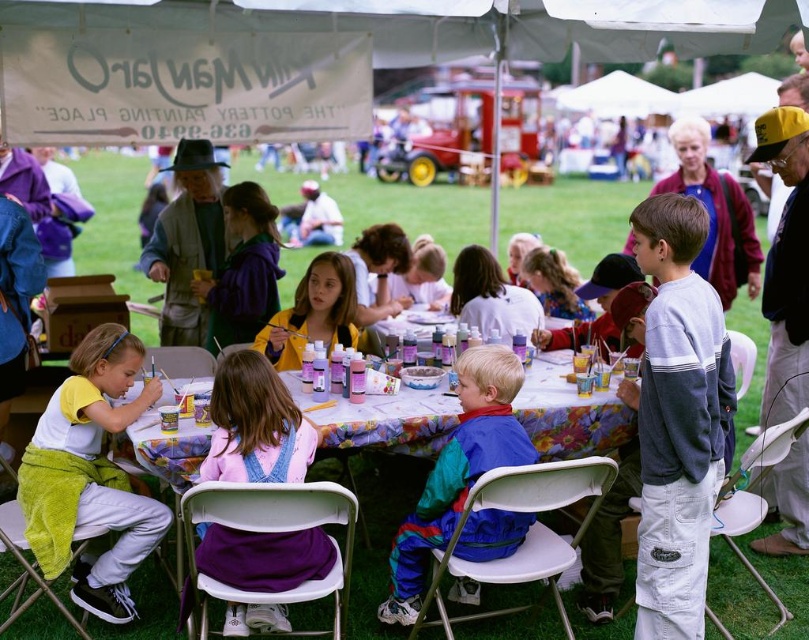
Question: Is white cotton shirt at center below rainbow nylon jacket at center?

Choices:
 (A) no
 (B) yes

Answer: (A)

Question: From the image, what is the correct spatial relationship of gray cotton sweatshirt at right in relation to floral tablecloth at center?

Choices:
 (A) below
 (B) above

Answer: (B)

Question: Considering the real-world distances, which object is closest to the rainbow nylon jacket at center?

Choices:
 (A) gray cotton sweatshirt at right
 (B) white cotton shirt at center
 (C) floral tablecloth at center

Answer: (C)

Question: Which object is closer to the camera taking this photo?

Choices:
 (A) white cotton shirt at center
 (B) floral tablecloth at center
 (C) gray cotton sweatshirt at right

Answer: (C)

Question: Where is floral tablecloth at center located in relation to rainbow nylon jacket at center in the image?

Choices:
 (A) right
 (B) left

Answer: (B)

Question: Which of the following is the closest to the observer?

Choices:
 (A) gray cotton sweatshirt at right
 (B) floral tablecloth at center
 (C) rainbow nylon jacket at center
 (D) white cotton shirt at center

Answer: (A)